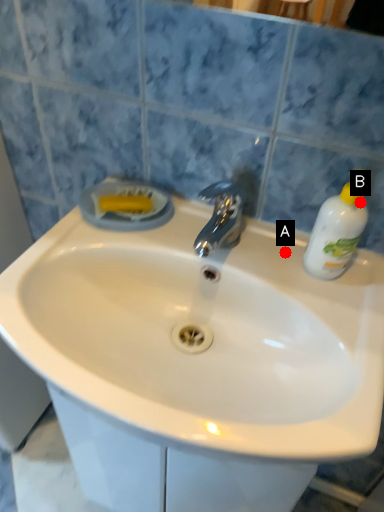
Question: Two points are circled on the image, labeled by A and B beside each circle. Among these points, which one is nearest to the camera?

Choices:
 (A) A is closer
 (B) B is closer

Answer: (B)